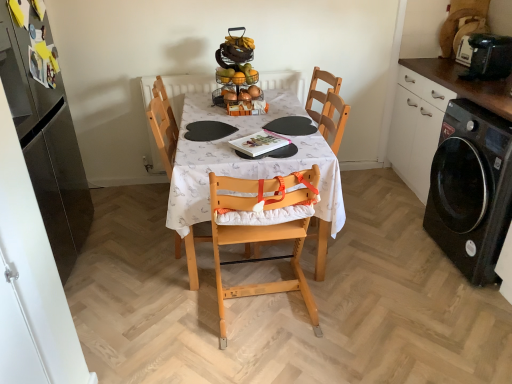
Where is `vacant area that lies between white fabric table at center and light wood highchair at center, which is the 2th chair in left-to-right order`? This screenshot has width=512, height=384. vacant area that lies between white fabric table at center and light wood highchair at center, which is the 2th chair in left-to-right order is located at coordinates (259, 309).